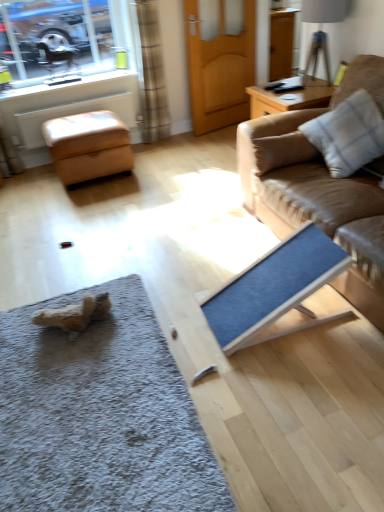
Question: Is wooden door at center in contact with matte brown armchair at upper left?

Choices:
 (A) no
 (B) yes

Answer: (A)

Question: Is wooden door at center located outside matte brown armchair at upper left?

Choices:
 (A) yes
 (B) no

Answer: (A)

Question: From the image's perspective, would you say wooden door at center is shown under matte brown armchair at upper left?

Choices:
 (A) yes
 (B) no

Answer: (B)

Question: Is wooden door at center positioned behind matte brown armchair at upper left?

Choices:
 (A) no
 (B) yes

Answer: (A)

Question: Is wooden door at center far from matte brown armchair at upper left?

Choices:
 (A) yes
 (B) no

Answer: (A)

Question: Is wooden door at center facing away from matte brown armchair at upper left?

Choices:
 (A) yes
 (B) no

Answer: (B)

Question: Can you confirm if leather ottoman at left is taller than wooden door at center?

Choices:
 (A) yes
 (B) no

Answer: (B)

Question: Considering the relative positions of leather ottoman at left and wooden door at center in the image provided, is leather ottoman at left to the left of wooden door at center from the viewer's perspective?

Choices:
 (A) yes
 (B) no

Answer: (A)

Question: Can wooden door at center be found inside leather ottoman at left?

Choices:
 (A) yes
 (B) no

Answer: (B)

Question: Is leather ottoman at left wider than wooden door at center?

Choices:
 (A) yes
 (B) no

Answer: (A)

Question: Is leather ottoman at left oriented towards wooden door at center?

Choices:
 (A) yes
 (B) no

Answer: (B)

Question: Does leather ottoman at left have a lesser width compared to wooden door at center?

Choices:
 (A) no
 (B) yes

Answer: (A)

Question: Can you confirm if brown textured curtain at upper left is smaller than matte brown armchair at upper left?

Choices:
 (A) no
 (B) yes

Answer: (A)